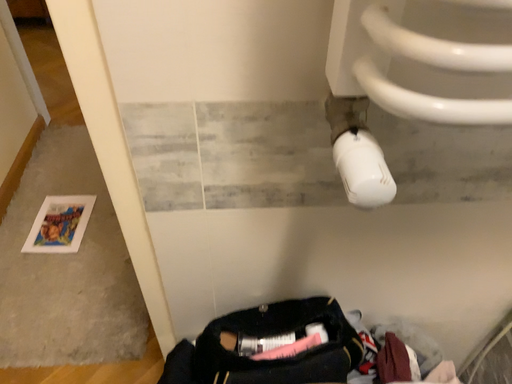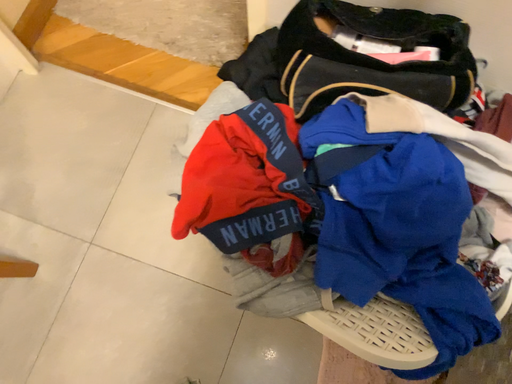
Question: Which way did the camera rotate in the video?

Choices:
 (A) rotated downward
 (B) rotated upward

Answer: (A)